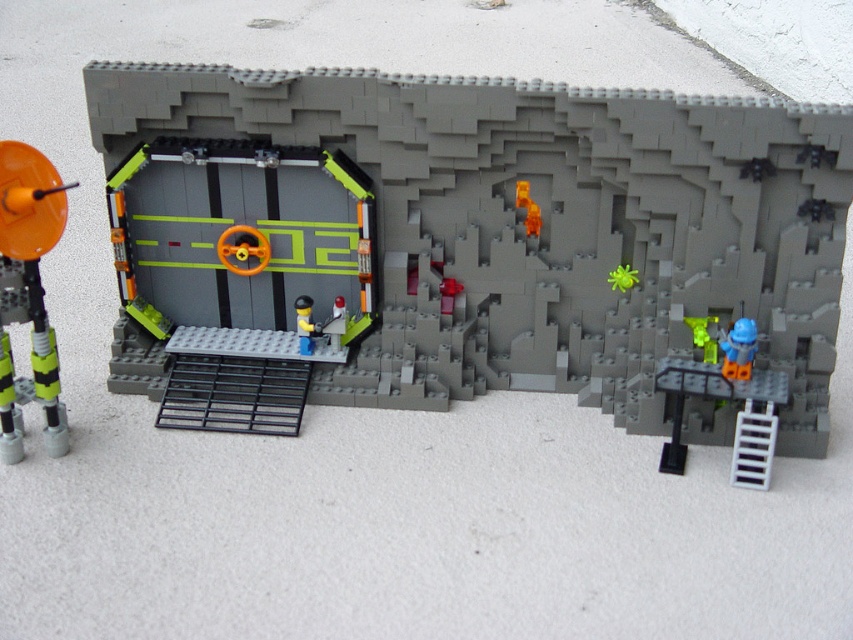
In the LEGO construction scene, you notice the matte gray wall at center and the green matte figure at center. Which object is taller?

The matte gray wall at center is taller than the green matte figure at center.

You are a LEGO designer trying to place a new decorative element between the orange matte door at center and the smooth plastic figure at center. Based on their sizes, which object should the decorative element be placed closer to?

The decorative element should be placed closer to the orange matte door at center because it is smaller than the smooth plastic figure at center.